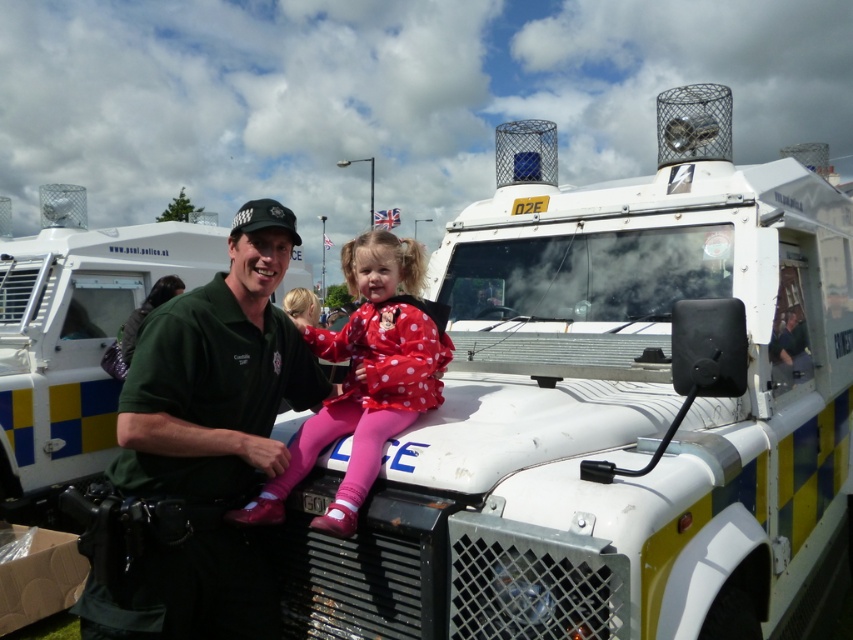
You are a tailor who needs to determine which green garment requires more fabric to make between the green uniform at center and the green fabric jacket at left. Based on the image, which one would need more fabric?

The green uniform at center requires more fabric than the green fabric jacket at left because it is bigger in size.

You are a photographer trying to capture a clear photo of both the green uniform at center and the green fabric jacket at left. Since you want both subjects to be in focus, which one should you adjust your camera focus on first?

The green uniform at center is closer to the viewer than the green fabric jacket at left, so you should focus on the green uniform at center first to ensure both are in focus.